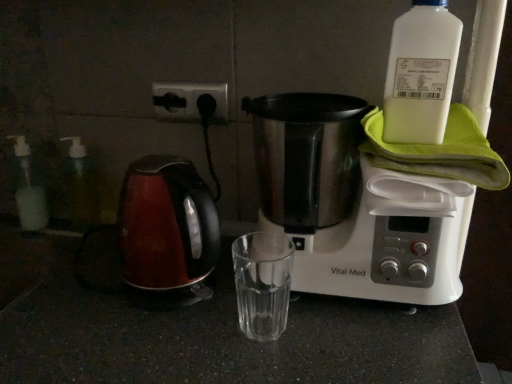
Question: Considering the positions of point (80, 200) and point (42, 211), is point (80, 200) closer or farther from the camera than point (42, 211)?

Choices:
 (A) farther
 (B) closer

Answer: (A)

Question: Considering the positions of transparent plastic bottle at left, the 2th bottle positioned from the front, and translucent plastic soap dispenser at left, the first bottle viewed from the left, in the image, is transparent plastic bottle at left, the 2th bottle positioned from the front, wider or thinner than translucent plastic soap dispenser at left, the first bottle viewed from the left,?

Choices:
 (A) thin
 (B) wide

Answer: (A)

Question: Considering the real-world distances, which object is farthest from the transparent plastic bottle at left, positioned as the 2th bottle in left-to-right order?

Choices:
 (A) translucent plastic soap dispenser at left, the 3th bottle positioned from the right
 (B) white plastic bottle at upper right, the first bottle in the front-to-back sequence
 (C) black plastic socket at upper center
 (D) shiny red kettle at left
 (E) stainless steel coffee maker at upper right

Answer: (B)

Question: Which is nearer to the shiny red kettle at left?

Choices:
 (A) translucent plastic soap dispenser at left, the 3th bottle positioned from the right
 (B) black plastic socket at upper center
 (C) transparent plastic bottle at left, positioned as the 2th bottle in left-to-right order
 (D) white plastic bottle at upper right, marked as the first bottle in a right-to-left arrangement
 (E) stainless steel coffee maker at upper right

Answer: (E)